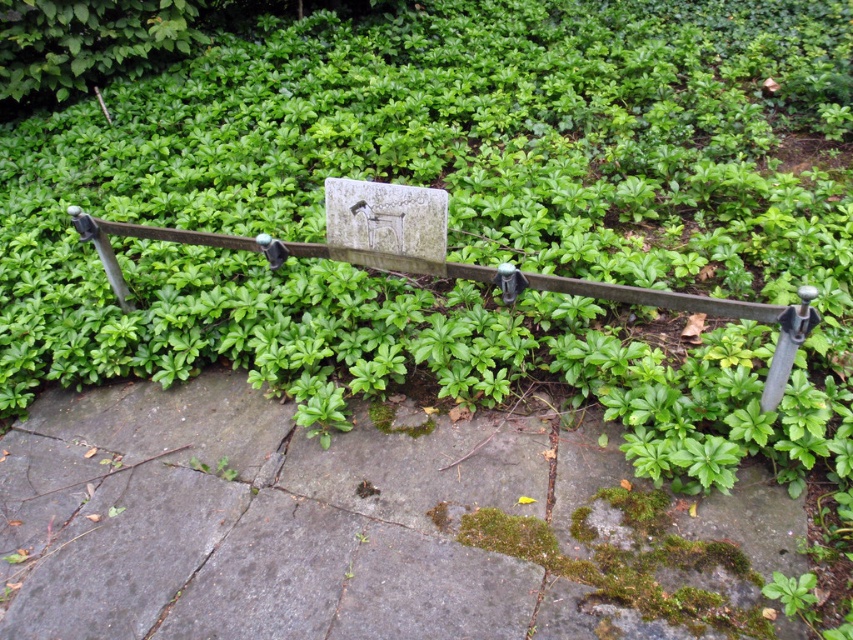
Looking at this image, does green metal fence at center have a lesser height compared to green leafy bush at upper left?

Correct, green metal fence at center is not as tall as green leafy bush at upper left.

Does point (337, 252) lie in front of point (107, 45)?

Yes, it is.

You are a GUI agent. You are given a task and a screenshot of the screen. Output one action in this format:
    pyautogui.click(x=<x>, y=<y>)
    Task: Click on the green metal fence at center
    
    Given the screenshot: What is the action you would take?
    pyautogui.click(x=479, y=280)

Is mossy stone pavement at center below green metal fence at center?

Yes, mossy stone pavement at center is below green metal fence at center.

Does mossy stone pavement at center have a lesser height compared to green metal fence at center?

No, mossy stone pavement at center is not shorter than green metal fence at center.

Is point (200, 595) positioned behind point (250, 237)?

No, it is not.

Where is `mossy stone pavement at center`? mossy stone pavement at center is located at coordinates (351, 525).

Does point (210, 524) come in front of point (80, 45)?

Yes.

Consider the image. Is mossy stone pavement at center thinner than green leafy bush at upper left?

No.

Which is in front, point (355, 486) or point (183, 12)?

Point (355, 486)

The height and width of the screenshot is (640, 853). I want to click on mossy stone pavement at center, so click(x=351, y=525).